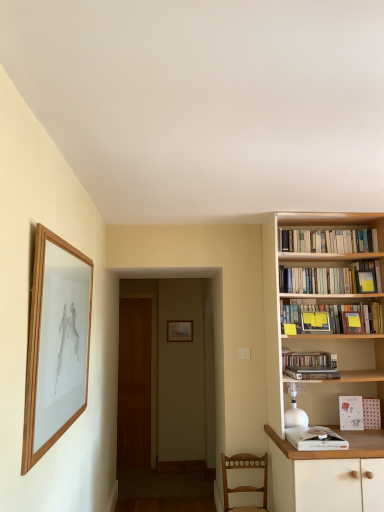
Locate an element on the screen. blank space situated above white paper book at lower right, which is the sixth book in top-to-bottom order (from a real-world perspective) is located at coordinates (316, 430).